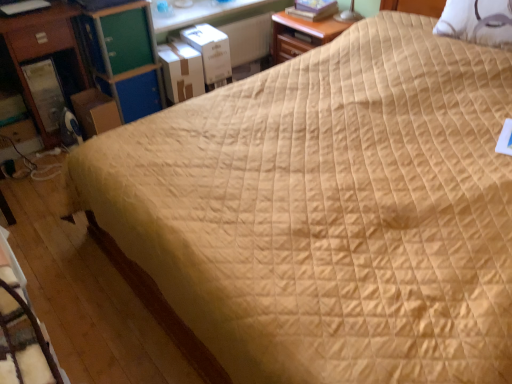
Question: Does point (14, 279) appear closer or farther from the camera than point (120, 87)?

Choices:
 (A) closer
 (B) farther

Answer: (A)

Question: Considering the positions of velvet brown rocking chair at lower left and green plastic file cabinet at upper left in the image, is velvet brown rocking chair at lower left taller or shorter than green plastic file cabinet at upper left?

Choices:
 (A) tall
 (B) short

Answer: (B)

Question: Estimate the real-world distances between objects in this image. Which object is closer to the white textured pillow at upper right?

Choices:
 (A) green wood drawer at upper left
 (B) white cardboard box at upper left, the 2th cardboard box in the left-to-right sequence
 (C) white cardboard box at upper center, which appears as the 3th cardboard box when viewed from the left
 (D) matte wood nightstand at upper center, the 2th nightstand in the left-to-right sequence
 (E) green plastic file cabinet at upper left

Answer: (D)

Question: Which of these objects is positioned closest to the matte wood nightstand at upper center, acting as the 1th nightstand starting from the right?

Choices:
 (A) brown cardboard box at left, which ranks as the 3th cardboard box in right-to-left order
 (B) green plastic file cabinet at upper left
 (C) white cardboard box at upper center, which is the 1th cardboard box in right-to-left order
 (D) white textured pillow at upper right
 (E) velvet brown rocking chair at lower left

Answer: (C)